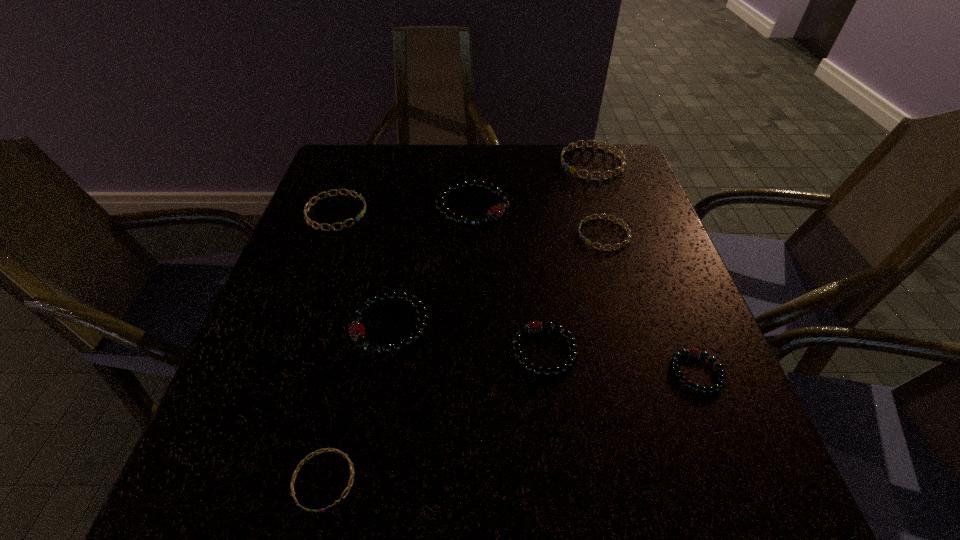
Where is `the tallest object`? The height and width of the screenshot is (540, 960). the tallest object is located at coordinates pos(495,212).

Identify the location of the tallest bracelet. (495, 212).

I want to click on the biggest blue bracelet, so click(x=622, y=157).

Identify the location of the farthest bracelet. This screenshot has height=540, width=960. (622, 157).

Where is `the third smallest black bracelet`? The height and width of the screenshot is (540, 960). the third smallest black bracelet is located at coordinates (356, 329).

Image resolution: width=960 pixels, height=540 pixels. In order to click on the leftmost blue bracelet in this screenshot , I will do `click(317, 198)`.

Where is `the leftmost object`? The height and width of the screenshot is (540, 960). the leftmost object is located at coordinates (317, 198).

Locate an element on the screen. the third biggest black bracelet is located at coordinates (529, 367).

This screenshot has height=540, width=960. Identify the location of the second smallest blue bracelet. (588, 242).

Locate an element on the screen. the rightmost black bracelet is located at coordinates (694, 353).